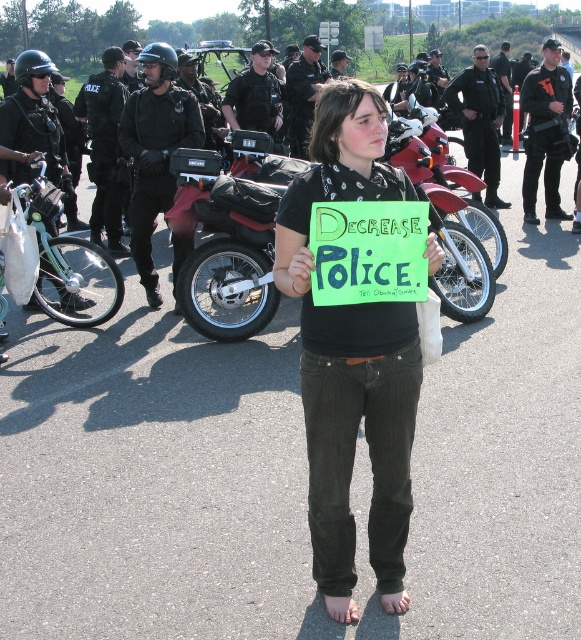
Question: Does white matte bicycle at left appear under black tactical vest at center?

Choices:
 (A) no
 (B) yes

Answer: (B)

Question: Among these points, which one is nearest to the camera?

Choices:
 (A) (306, 58)
 (B) (137, 243)

Answer: (B)

Question: From the image, what is the correct spatial relationship of black cotton shirt at center in relation to black uniformed officer at center?

Choices:
 (A) above
 (B) below

Answer: (B)

Question: Is black matte motorcycle at center smaller than black matte helmet at upper center?

Choices:
 (A) no
 (B) yes

Answer: (B)

Question: Among these points, which one is farthest from the camera?

Choices:
 (A) (367, 294)
 (B) (543, 170)
 (C) (42, 166)

Answer: (B)

Question: Which of these objects is positioned closest to the black matte helmet at upper center?

Choices:
 (A) black cotton shirt at center
 (B) black uniformed officer at center
 (C) black uniform at center
 (D) black tactical vest at center

Answer: (A)